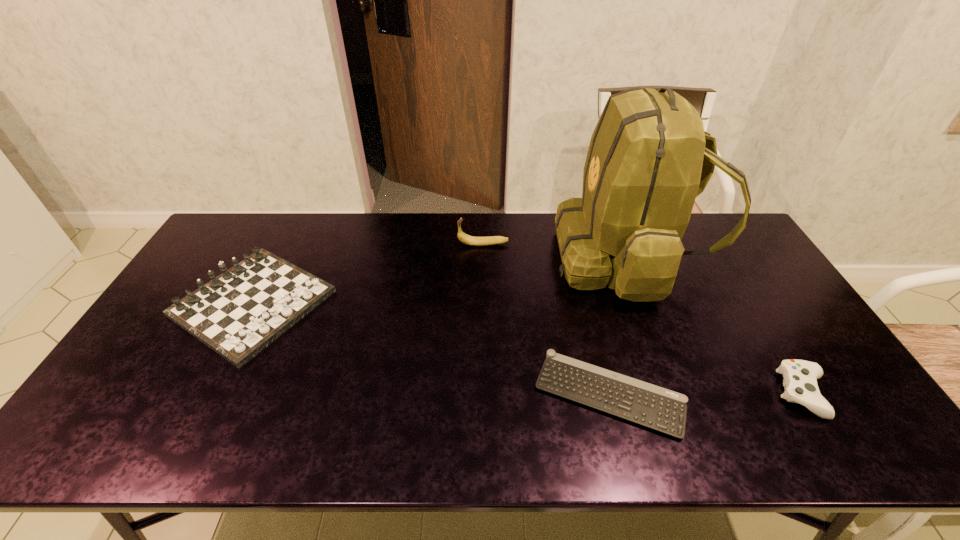
Locate an element on the screen. free space between the computer keyboard and the fourth tallest object is located at coordinates (707, 394).

You are a GUI agent. You are given a task and a screenshot of the screen. Output one action in this format:
    pyautogui.click(x=<x>, y=<y>)
    Task: Click on the free space between the fourth tallest object and the tallest object
    This screenshot has width=960, height=540.
    Given the screenshot: What is the action you would take?
    pyautogui.click(x=715, y=325)

What are the coordinates of `vacant space that's between the control and the second object from left to right` in the screenshot? It's located at (643, 319).

Find the location of `free spot between the chessboard and the fourth object from right to left`. free spot between the chessboard and the fourth object from right to left is located at coordinates (369, 274).

Locate an element on the screen. Image resolution: width=960 pixels, height=540 pixels. vacant space that's between the second object from left to right and the backpack is located at coordinates (556, 251).

Where is `free space between the chessboard and the fourth object from right to left`? The width and height of the screenshot is (960, 540). free space between the chessboard and the fourth object from right to left is located at coordinates (369, 274).

At what (x,y) coordinates should I click in order to perform the action: click on vacant space that is in between the tallest object and the second shortest object. Please return your answer as a coordinate pair (x, y). The height and width of the screenshot is (540, 960). Looking at the image, I should click on (715, 325).

Where is `free space between the shortest object and the second tallest object`? This screenshot has height=540, width=960. free space between the shortest object and the second tallest object is located at coordinates (546, 319).

Image resolution: width=960 pixels, height=540 pixels. What are the coordinates of `empty space between the backpack and the fourth tallest object` in the screenshot? It's located at (715, 325).

You are a GUI agent. You are given a task and a screenshot of the screen. Output one action in this format:
    pyautogui.click(x=<x>, y=<y>)
    Task: Click on the object that is the third closest to the tallest object
    Image resolution: width=960 pixels, height=540 pixels.
    Given the screenshot: What is the action you would take?
    800,377